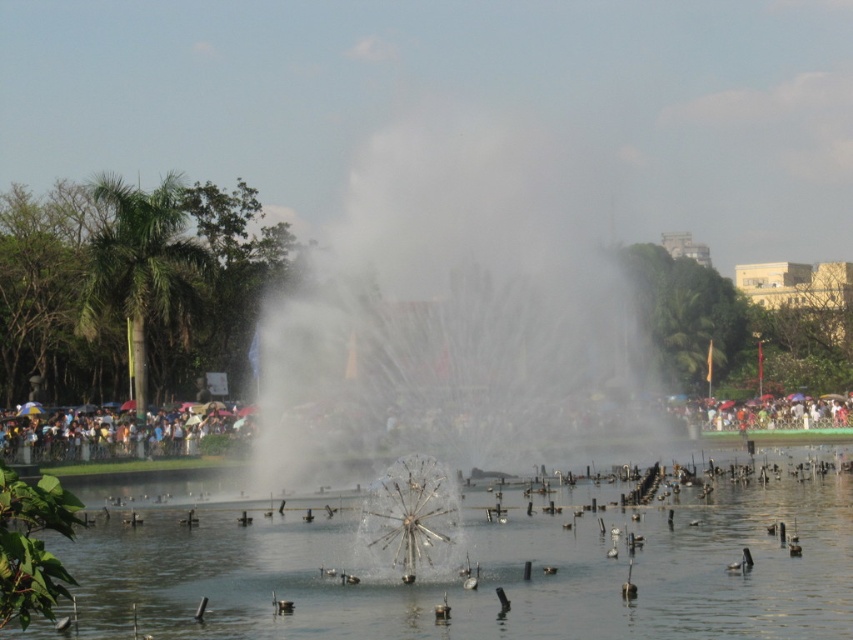
Question: Can you confirm if white matte duck at center is positioned above brown matte duck at lower center?

Choices:
 (A) yes
 (B) no

Answer: (A)

Question: Which point is closer to the camera?

Choices:
 (A) clear water at center
 (B) brown fuzzy duck at center
 (C) brown matte duck at lower center
 (D) white matte duck at center

Answer: (A)

Question: Is white matte duck at center to the right of brown matte duck at center from the viewer's perspective?

Choices:
 (A) yes
 (B) no

Answer: (A)

Question: Is white matte duck at center to the right of brown fuzzy duck at center from the viewer's perspective?

Choices:
 (A) no
 (B) yes

Answer: (A)

Question: Which object is positioned closest to the brown fuzzy duck at center?

Choices:
 (A) white matte duck at center
 (B) clear water at center
 (C) brown matte duck at lower center

Answer: (A)

Question: Among these objects, which one is nearest to the camera?

Choices:
 (A) clear water at center
 (B) brown matte duck at center

Answer: (A)